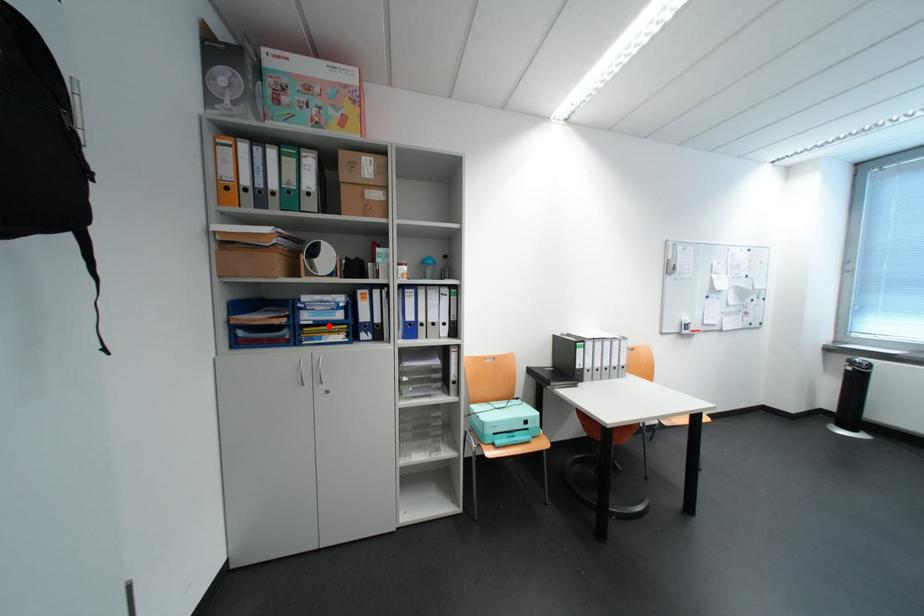
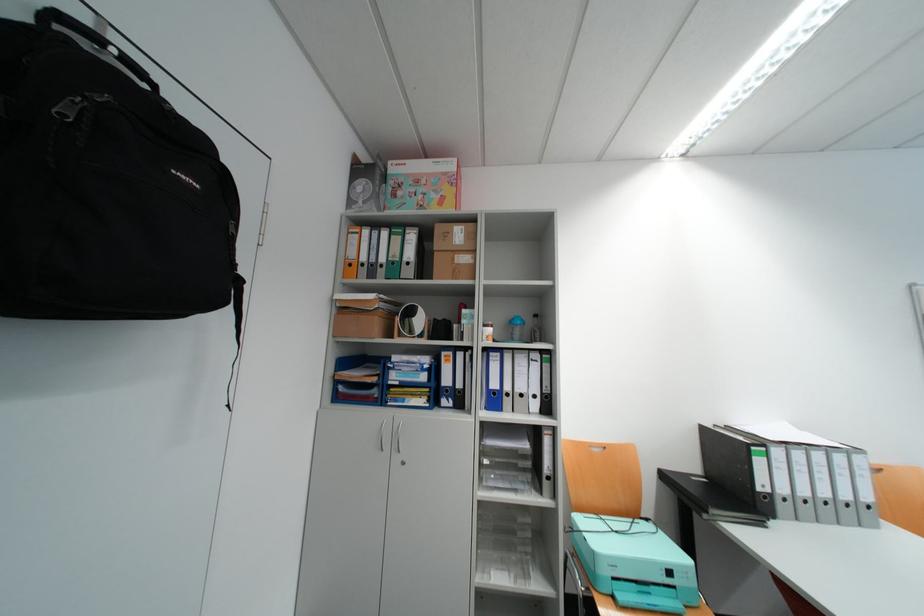
Locate, in the second image, the point that corresponds to the highlighted location in the first image.

(415, 387)